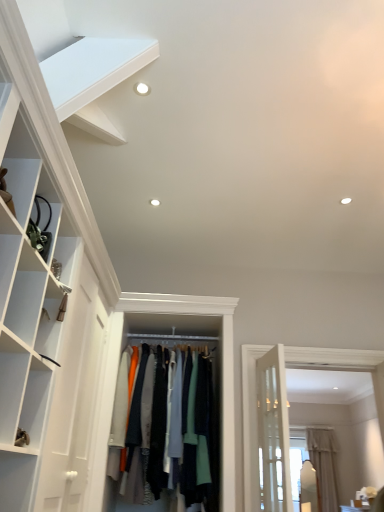
Question: Is knit fabric sweater at center located outside white matte shelf at upper left?

Choices:
 (A) no
 (B) yes

Answer: (B)

Question: Is knit fabric sweater at center positioned far away from white matte shelf at upper left?

Choices:
 (A) no
 (B) yes

Answer: (B)

Question: Can you confirm if knit fabric sweater at center is wider than white matte shelf at upper left?

Choices:
 (A) no
 (B) yes

Answer: (B)

Question: From the image's perspective, is knit fabric sweater at center below white matte shelf at upper left?

Choices:
 (A) no
 (B) yes

Answer: (B)

Question: Can you confirm if knit fabric sweater at center is thinner than white matte shelf at upper left?

Choices:
 (A) no
 (B) yes

Answer: (A)

Question: Does knit fabric sweater at center come in front of white matte shelf at upper left?

Choices:
 (A) yes
 (B) no

Answer: (B)

Question: Is knit fabric sweater at center shorter than beige fabric curtain at right?

Choices:
 (A) no
 (B) yes

Answer: (B)

Question: From the image's perspective, does knit fabric sweater at center appear higher than beige fabric curtain at right?

Choices:
 (A) no
 (B) yes

Answer: (B)

Question: From a real-world perspective, is knit fabric sweater at center located higher than beige fabric curtain at right?

Choices:
 (A) yes
 (B) no

Answer: (A)

Question: Can we say knit fabric sweater at center lies outside beige fabric curtain at right?

Choices:
 (A) yes
 (B) no

Answer: (A)

Question: Is knit fabric sweater at center facing away from beige fabric curtain at right?

Choices:
 (A) no
 (B) yes

Answer: (A)

Question: Is knit fabric sweater at center at the right side of beige fabric curtain at right?

Choices:
 (A) no
 (B) yes

Answer: (A)

Question: Considering the relative sizes of beige fabric curtain at right and white matte shelf at upper left in the image provided, is beige fabric curtain at right bigger than white matte shelf at upper left?

Choices:
 (A) no
 (B) yes

Answer: (B)